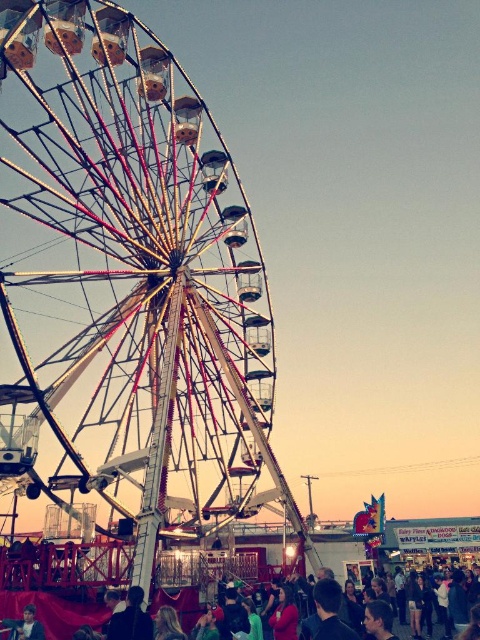
Question: Among these objects, which one is farthest from the camera?

Choices:
 (A) metallic ferris wheel at left
 (B) matte black crowd at lower center
 (C) matte black jacket at lower left

Answer: (B)

Question: Does metallic ferris wheel at left appear on the left side of matte black jacket at lower left?

Choices:
 (A) no
 (B) yes

Answer: (A)

Question: Can you confirm if matte black crowd at lower center is positioned below matte black jacket at lower center?

Choices:
 (A) no
 (B) yes

Answer: (B)

Question: Observing the image, what is the correct spatial positioning of metallic ferris wheel at left in reference to matte black crowd at lower center?

Choices:
 (A) below
 (B) above

Answer: (B)

Question: Which of these objects is positioned closest to the matte black jacket at lower center?

Choices:
 (A) matte black jacket at lower left
 (B) metallic ferris wheel at left
 (C) matte black crowd at lower center

Answer: (C)

Question: Which is nearer to the metallic ferris wheel at left?

Choices:
 (A) matte black jacket at lower left
 (B) matte black jacket at lower center

Answer: (B)